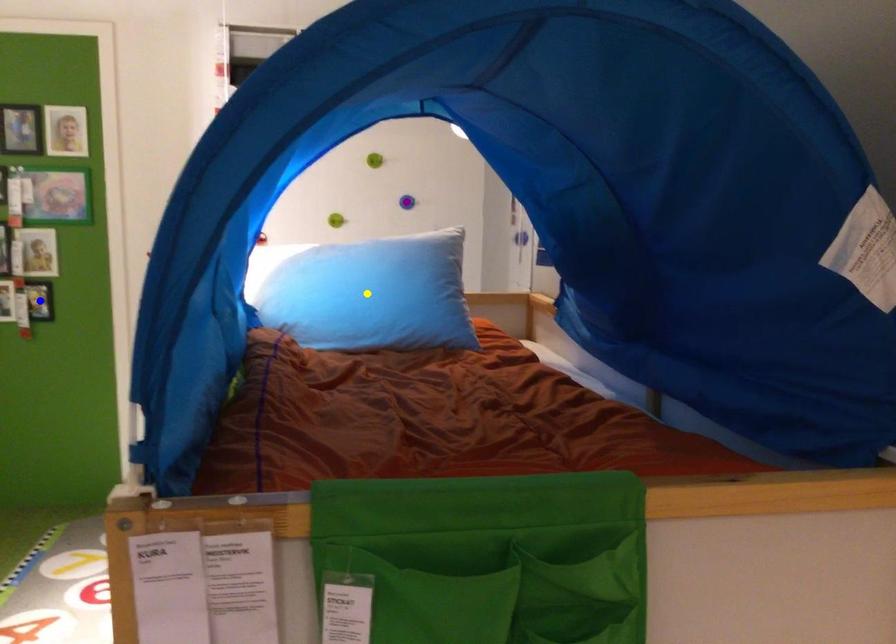
Order these from nearest to farthest:
purple point, blue point, yellow point

1. yellow point
2. blue point
3. purple point